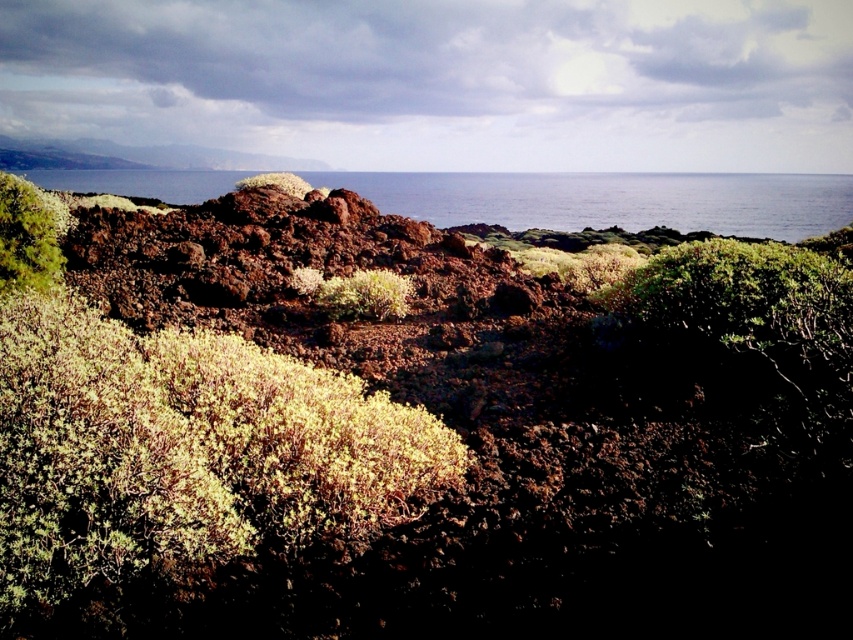
You are standing at the edge of the volcanic rock formations in the coastal landscape. You see two points marked on the ground. The first point is located at coordinates point (x=370, y=305), and the second point is at point (x=283, y=188). If you want to walk towards the ocean, which point should you head towards first?

Point (x=370, y=305) is in front of point (x=283, y=188), so you should head towards point (x=370, y=305) first to reach the ocean more quickly.

You are standing at the point marked as point (25, 237) in the image. Looking around, you see a green fuzzy bush at upper left. What is the nearest object to you?

The nearest object to you is the green fuzzy bush at upper left located at point (25, 237).

You are a hiker who wants to take a photo of the green fuzzy bush at center and the green fuzzy rock at center. Since you want the bush to be clearly visible in the foreground, which object should you focus on first?

The green fuzzy bush at center is positioned under green fuzzy rock at center, so you should focus on the green fuzzy rock at center first to ensure the bush appears sharp in the foreground.